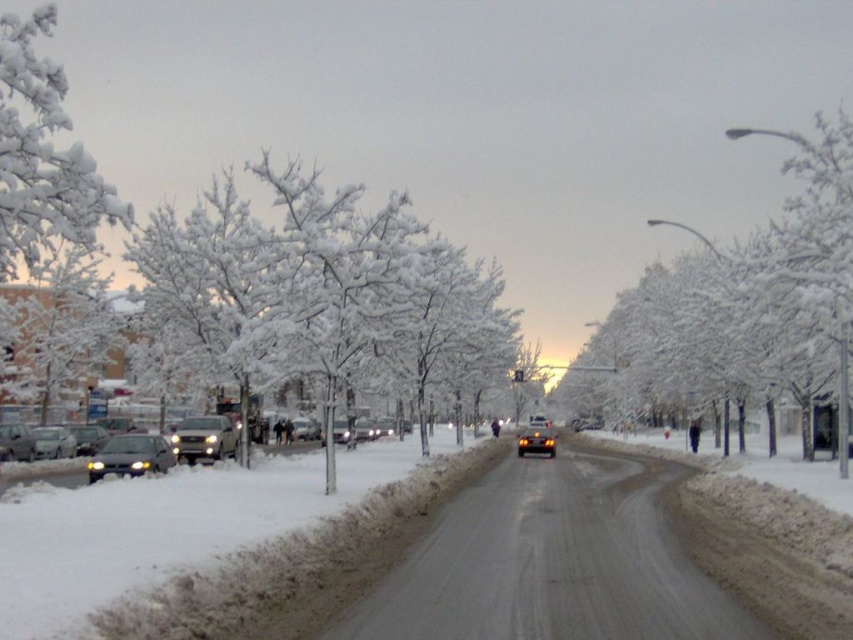
Is shiny silver sedan at left taller than shiny silver car at center?

No.

Is shiny silver sedan at left behind shiny silver car at center?

No, shiny silver sedan at left is in front of shiny silver car at center.

The height and width of the screenshot is (640, 853). Describe the element at coordinates (131, 456) in the screenshot. I see `shiny silver sedan at left` at that location.

You are a GUI agent. You are given a task and a screenshot of the screen. Output one action in this format:
    pyautogui.click(x=<x>, y=<y>)
    Task: Click on the shiny silver sedan at left
    This screenshot has height=640, width=853.
    Given the screenshot: What is the action you would take?
    pyautogui.click(x=131, y=456)

Who is positioned more to the right, satin silver suv at left or matte silver sedan at left?

From the viewer's perspective, satin silver suv at left appears more on the right side.

Between point (212, 435) and point (45, 435), which one is positioned in front?

Point (212, 435) is more forward.

At what (x,y) coordinates should I click in order to perform the action: click on satin silver suv at left. Please return your answer as a coordinate pair (x, y). The height and width of the screenshot is (640, 853). Looking at the image, I should click on (204, 440).

Which is behind, point (796, 392) or point (190, 442)?

Point (796, 392)

Is white snow-covered tree at right below satin silver suv at left?

No.

At what (x,y) coordinates should I click in order to perform the action: click on white snow-covered tree at right. Please return your answer as a coordinate pair (x, y). The width and height of the screenshot is (853, 640). Looking at the image, I should click on (763, 296).

Locate an element on the screen. white snow-covered tree at right is located at coordinates pyautogui.click(x=763, y=296).